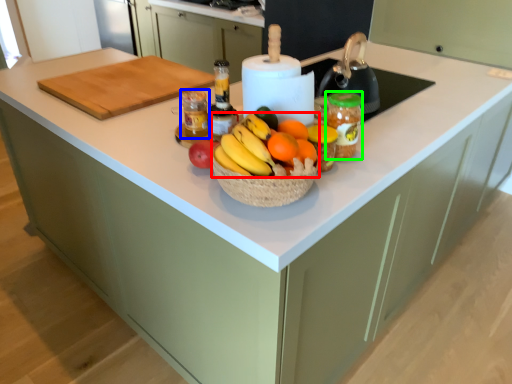
Question: Which object is positioned farthest from grapefruit (highlighted by a red box)? Select from bottle (highlighted by a blue box) and glass jar (highlighted by a green box).

Choices:
 (A) bottle
 (B) glass jar

Answer: (A)